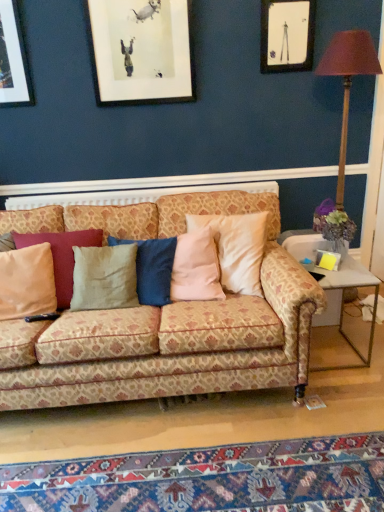
Where is `vacant area that is in front of metal/glass side table at lower right`? Image resolution: width=384 pixels, height=512 pixels. vacant area that is in front of metal/glass side table at lower right is located at coordinates (342, 387).